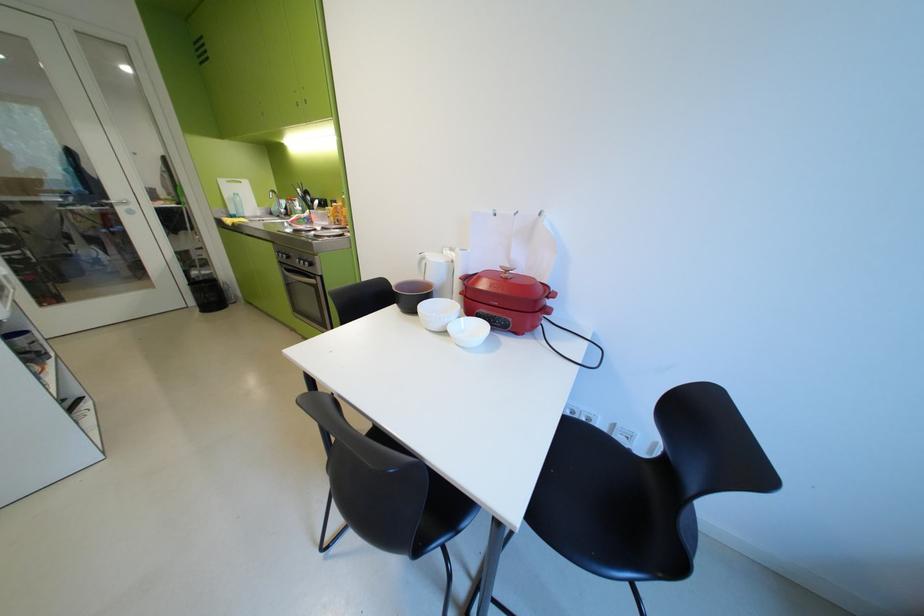
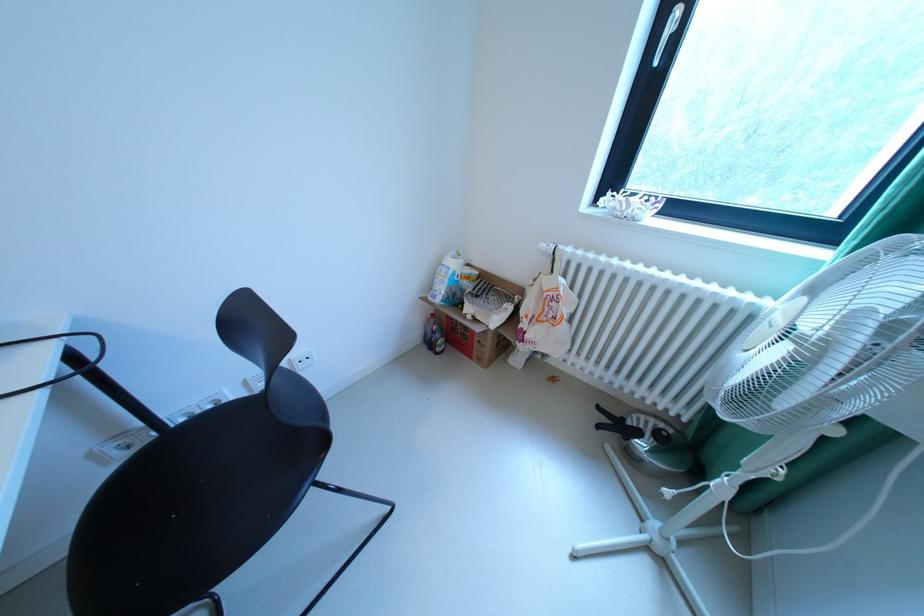
How did the camera likely rotate?

The camera rotated toward right-down.